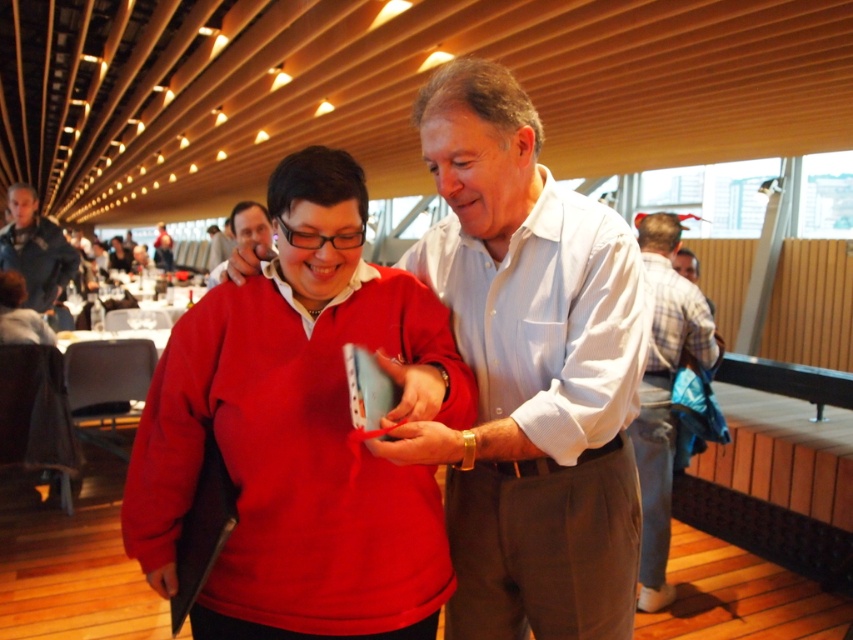
Question: Can you confirm if light blue shirt at center is positioned above matte black jacket at center?

Choices:
 (A) yes
 (B) no

Answer: (B)

Question: Which point is closer to the camera?

Choices:
 (A) plaid shirt at right
 (B) dark gray jacket at left

Answer: (A)

Question: Which object appears farthest from the camera in this image?

Choices:
 (A) light blue button-down shirt at center
 (B) matte black glasses at center
 (C) plaid shirt at right
 (D) matte black jacket at center

Answer: (D)

Question: Considering the real-world distances, which object is farthest from the matte black glasses at center?

Choices:
 (A) light blue shirt at center
 (B) plaid shirt at right
 (C) matte black jacket at center
 (D) dark gray jacket at left

Answer: (C)

Question: Is light blue button-down shirt at center positioned behind plaid shirt at right?

Choices:
 (A) yes
 (B) no

Answer: (B)

Question: Does light blue button-down shirt at center have a greater width compared to matte black glasses at center?

Choices:
 (A) yes
 (B) no

Answer: (B)